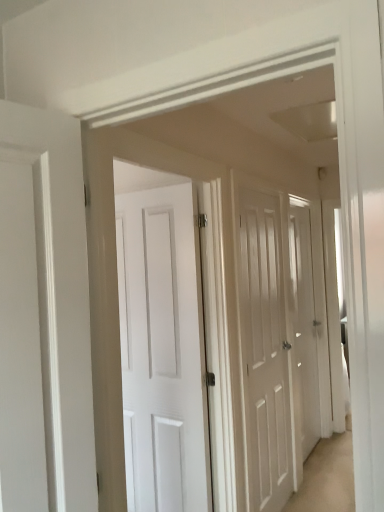
Question: Is white wood door at center, which ranks as the 2th door in right-to-left order, not near white matte door at center, which ranks as the first door in right-to-left order?

Choices:
 (A) yes
 (B) no

Answer: (B)

Question: From a real-world perspective, is white wood door at center, which ranks as the 1th door in front-to-back order, on top of white matte door at center, which ranks as the first door in right-to-left order?

Choices:
 (A) no
 (B) yes

Answer: (B)

Question: Is white wood door at center, the 1th door positioned from the left, bigger than white matte door at center, which ranks as the first door in right-to-left order?

Choices:
 (A) yes
 (B) no

Answer: (A)

Question: From a real-world perspective, is white wood door at center, placed as the second door when sorted from back to front, located beneath white matte door at center, positioned as the 2th door in front-to-back order?

Choices:
 (A) yes
 (B) no

Answer: (B)

Question: Can you confirm if white wood door at center, which ranks as the 1th door in front-to-back order, is smaller than white matte door at center, the 2th door from the left?

Choices:
 (A) yes
 (B) no

Answer: (B)

Question: Can you confirm if white wood door at center, which ranks as the 1th door in front-to-back order, is taller than white matte door at center, which is the 1th door from back to front?

Choices:
 (A) no
 (B) yes

Answer: (B)

Question: Is white matte door at center, which is the 1th door from back to front, to the right of white wood door at center, the 1th door positioned from the left, from the viewer's perspective?

Choices:
 (A) no
 (B) yes

Answer: (B)

Question: Does white matte door at center, which ranks as the first door in right-to-left order, have a smaller size compared to white wood door at center, which ranks as the 2th door in right-to-left order?

Choices:
 (A) no
 (B) yes

Answer: (B)

Question: From a real-world perspective, is white matte door at center, the 2th door from the left, positioned over white wood door at center, placed as the second door when sorted from back to front, based on gravity?

Choices:
 (A) yes
 (B) no

Answer: (B)

Question: Is white matte door at center, the 2th door from the left, not within white wood door at center, which ranks as the 1th door in front-to-back order?

Choices:
 (A) no
 (B) yes

Answer: (B)

Question: Considering the relative sizes of white matte door at center, the 2th door from the left, and white wood door at center, placed as the second door when sorted from back to front, in the image provided, is white matte door at center, the 2th door from the left, wider than white wood door at center, placed as the second door when sorted from back to front,?

Choices:
 (A) yes
 (B) no

Answer: (B)

Question: Considering the relative positions of white matte door at center, which is the 1th door from back to front, and white wood door at center, which ranks as the 1th door in front-to-back order, in the image provided, is white matte door at center, which is the 1th door from back to front, to the left of white wood door at center, which ranks as the 1th door in front-to-back order, from the viewer's perspective?

Choices:
 (A) no
 (B) yes

Answer: (A)

Question: From the image's perspective, relative to white wood door at center, the 1th door positioned from the left, is white matte door at center, the 2th door from the left, above or below?

Choices:
 (A) above
 (B) below

Answer: (A)